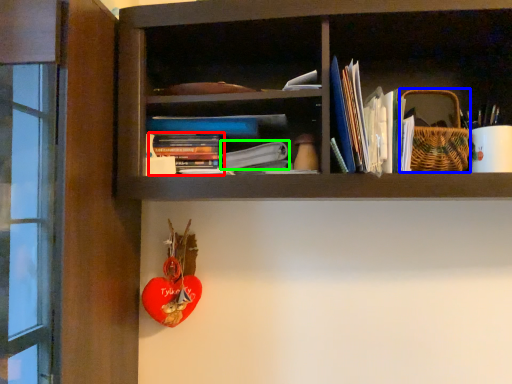
Question: Which is nearer to the book (highlighted by a red box)? basket (highlighted by a blue box) or paperback book (highlighted by a green box).

Choices:
 (A) basket
 (B) paperback book

Answer: (B)